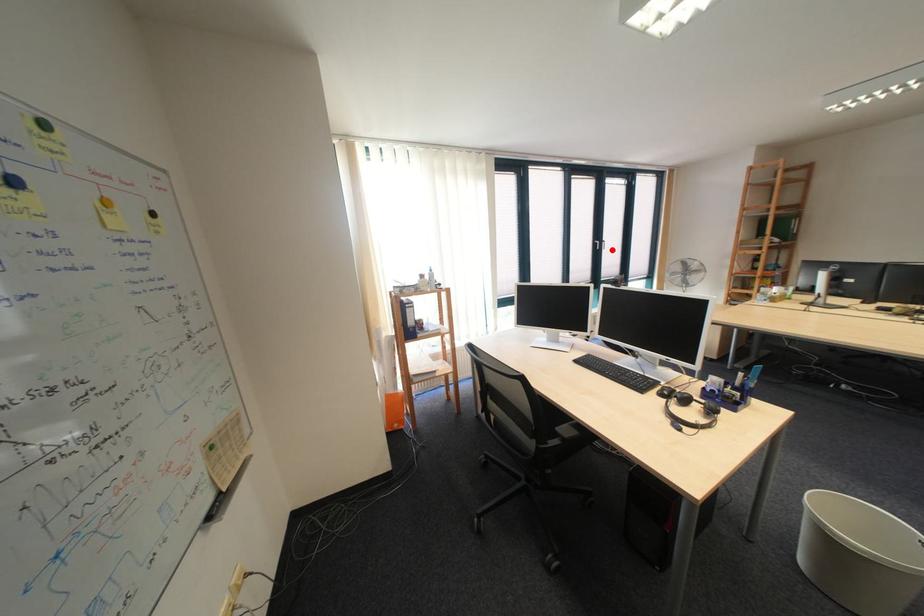
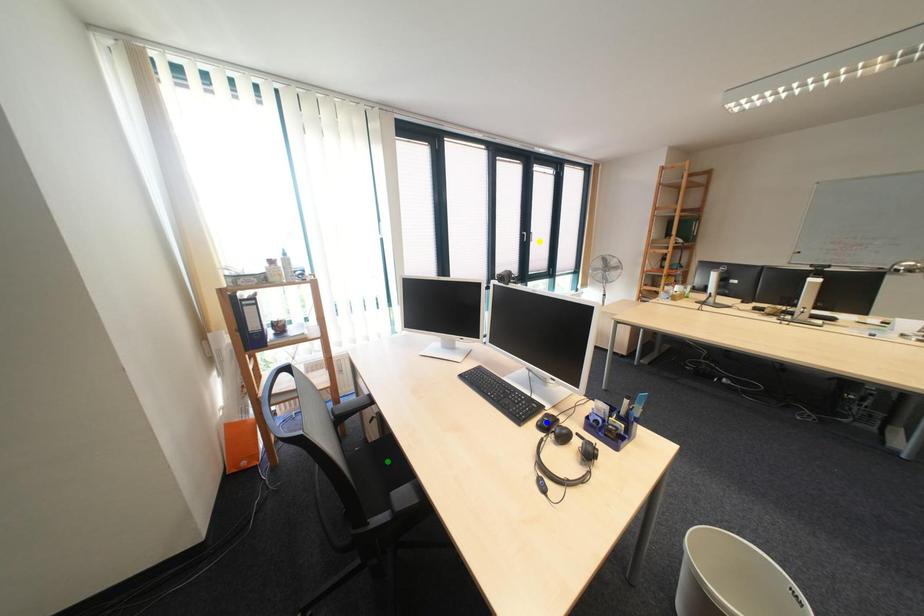
Question: I am providing you with two images of the same scene from different viewpoints. A red point is marked on the first image. You are given multiple points on the second image. Can you choose the point in image 2 that corresponds to the point in image 1?

Choices:
 (A) yellow point
 (B) green point
 (C) blue point

Answer: (A)